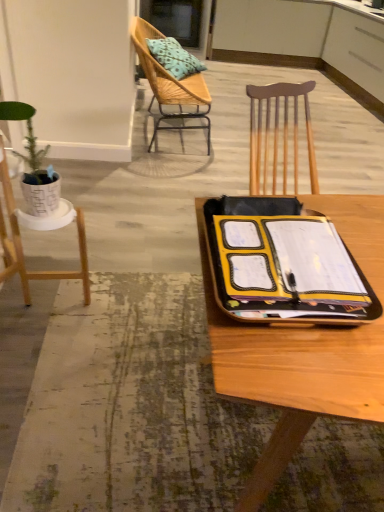
Question: Is blue patterned cushion at upper center taller or shorter than green matte plant pot at left?

Choices:
 (A) tall
 (B) short

Answer: (A)

Question: From the image's perspective, is blue patterned cushion at upper center located above or below green matte plant pot at left?

Choices:
 (A) above
 (B) below

Answer: (A)

Question: Which is farther from the yellow fabric binder at lower right?

Choices:
 (A) green matte plant pot at left
 (B) yellow matte notebook at center
 (C) white matte plant stand at left, the 1th chair positioned from the front
 (D) yellow fabric binder at center
 (E) blue patterned cushion at upper center

Answer: (E)

Question: Which is nearer to the woven wood chair at upper left, which is counted as the second chair, starting from the front?

Choices:
 (A) yellow fabric binder at center
 (B) yellow fabric binder at lower right
 (C) blue patterned cushion at upper center
 (D) white matte plant stand at left, which is counted as the second chair, starting from the top
 (E) green matte plant pot at left

Answer: (C)